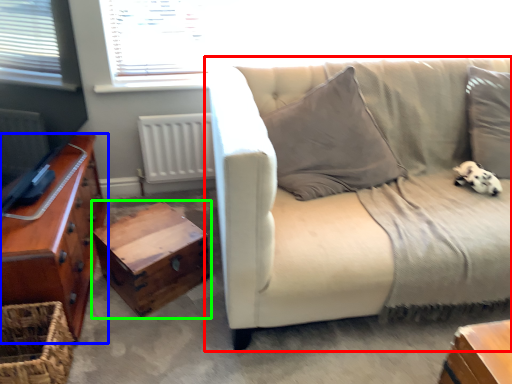
Question: Considering the real-world distances, which object is farthest from studio couch (highlighted by a red box)? chest of drawers (highlighted by a blue box) or table (highlighted by a green box)?

Choices:
 (A) chest of drawers
 (B) table

Answer: (A)